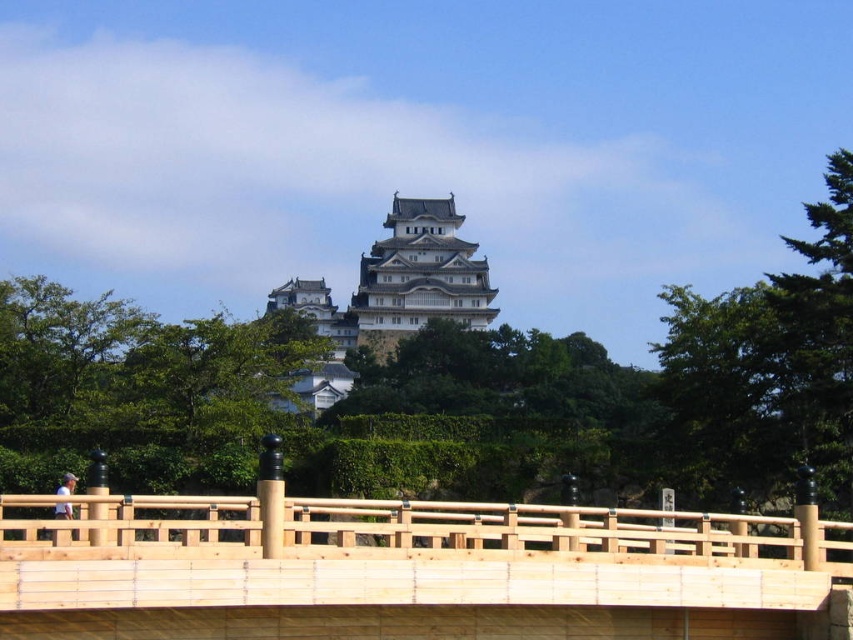
You are standing at the base of the hill where the traditional Japanese castle is located. You want to cross the light brown wooden bridge at center to reach the castle. Considering the distance, can you walk directly to the bridge without any obstacles?

The light brown wooden bridge at center is 109.81 feet away from you. Since there are no obstacles mentioned in the scene description, you can walk directly to the bridge.

You are standing on the hill near the traditional Japanese castle. You see the light brown wooden bridge at center and the green leafy tree at upper right. Which object is closer to your right side?

The green leafy tree at upper right is closer to your right side because it is positioned to the right of the light brown wooden bridge at center.

You are standing at the base of the castle hill and see the point marked at coordinates point (405,572). Based on the scene, where is this point located?

The point (405,572) is on the light brown wooden bridge at center.